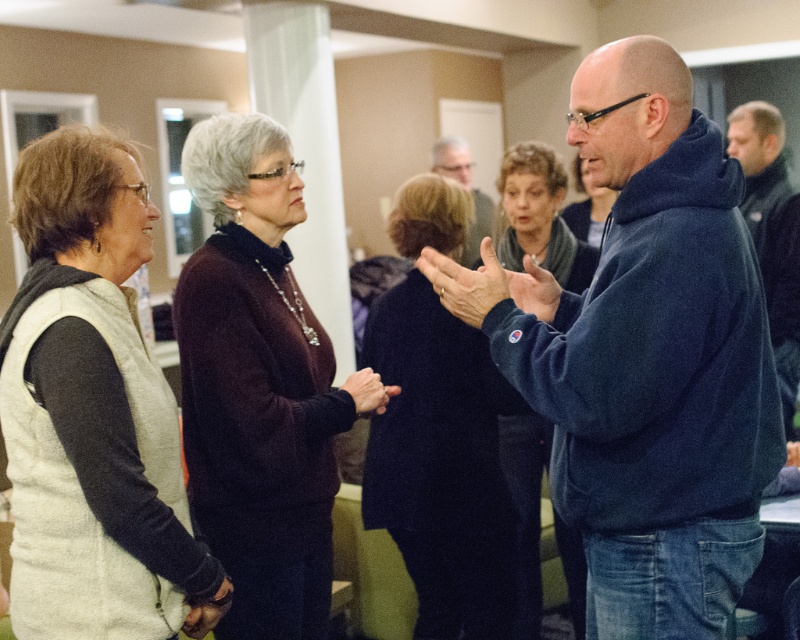
Question: Which object appears farthest from the camera in this image?

Choices:
 (A) smooth dark brown hand at center
 (B) matte blue hand at center
 (C) dark maroon sweater at center
 (D) matte gray sweater at center

Answer: (D)

Question: Is the position of dark blue fleece at center more distant than that of matte blue hand at center?

Choices:
 (A) yes
 (B) no

Answer: (B)

Question: Does dark maroon sweater at center appear under black fuzzy jacket at right?

Choices:
 (A) yes
 (B) no

Answer: (A)

Question: From the image, what is the correct spatial relationship of matte gray sweater at center in relation to smooth skin hand at center?

Choices:
 (A) left
 (B) right

Answer: (B)

Question: Which object appears closest to the camera in this image?

Choices:
 (A) smooth dark brown hand at center
 (B) black fuzzy jacket at right
 (C) dark maroon sweater at center

Answer: (C)

Question: Which object appears closest to the camera in this image?

Choices:
 (A) smooth skin hand at center
 (B) matte gray sweater at center
 (C) light beige vest at left
 (D) matte blue hand at center

Answer: (C)